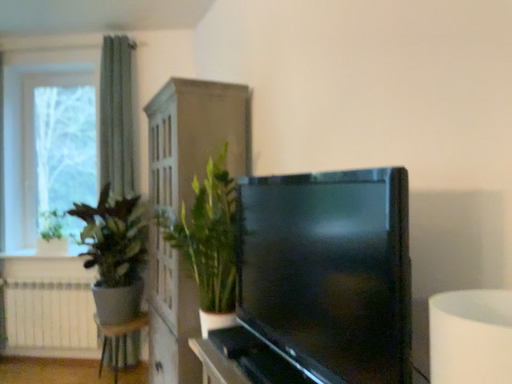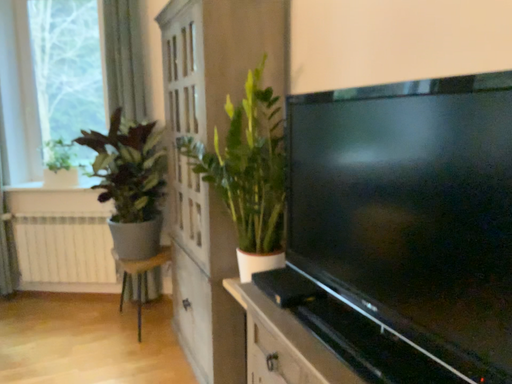
Question: Which way did the camera rotate in the video?

Choices:
 (A) rotated downward
 (B) rotated upward

Answer: (A)